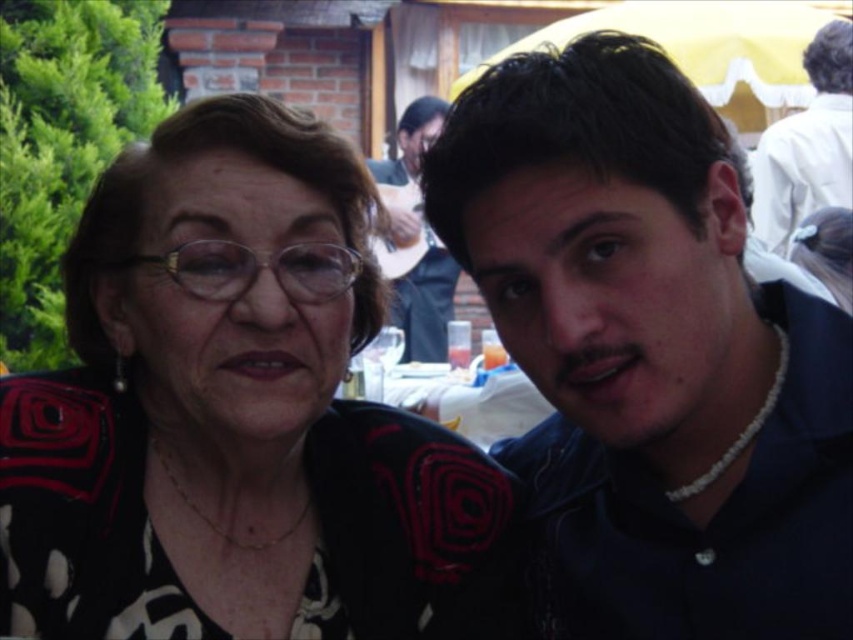
Question: Which point is farther to the camera?

Choices:
 (A) (764, 220)
 (B) (352, 220)
 (C) (563, 272)

Answer: (A)

Question: Does smooth black shirt at right appear under white plastic table at center?

Choices:
 (A) yes
 (B) no

Answer: (B)

Question: In this image, where is black textured jacket at upper left located relative to smooth blue shirt at right?

Choices:
 (A) above
 (B) below

Answer: (B)

Question: Which object appears closest to the camera in this image?

Choices:
 (A) white plastic table at center
 (B) black textured jacket at upper left
 (C) white shirt at upper right

Answer: (B)

Question: Estimate the real-world distances between objects in this image. Which object is farther from the white plastic table at center?

Choices:
 (A) smooth blue shirt at right
 (B) smooth black shirt at right
 (C) black textured jacket at upper left

Answer: (B)

Question: In this image, where is smooth blue shirt at right located relative to white plastic table at center?

Choices:
 (A) above
 (B) below

Answer: (A)